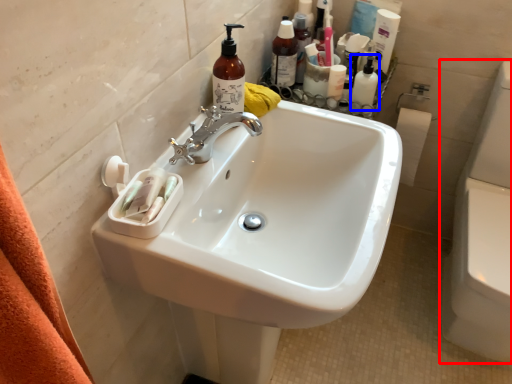
Question: Which point is closer to the camera, toilet bowl (highlighted by a red box) or toiletry (highlighted by a blue box)?

Choices:
 (A) toilet bowl
 (B) toiletry

Answer: (A)